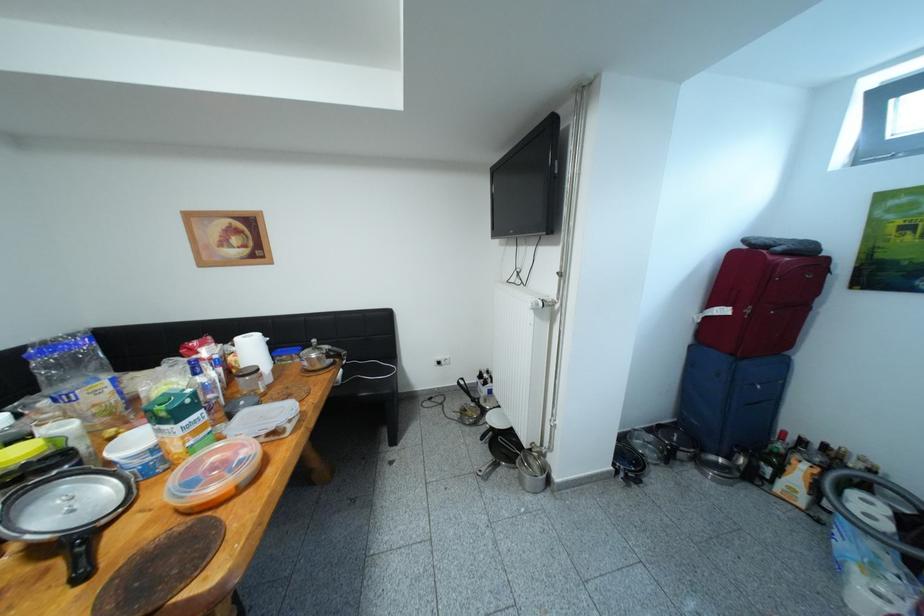
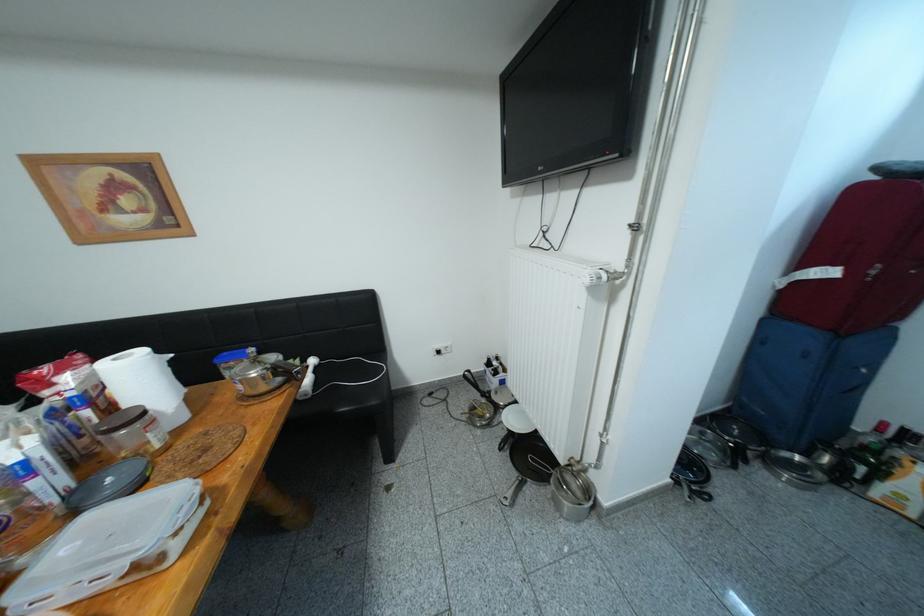
Question: Based on the continuous images, in which direction is the camera rotating? Reply with the corresponding letter.

Choices:
 (A) Left
 (B) Right
 (C) Up
 (D) Down

Answer: (D)